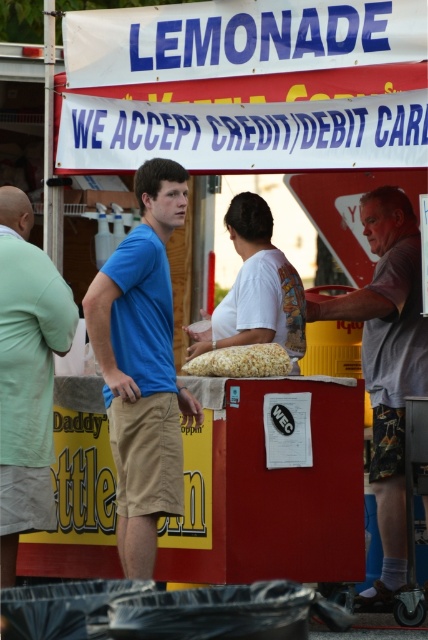
Is gray fabric shorts at right further to camera compared to golden popcorn at center?

Yes.

Between point (425, 515) and point (262, 374), which one is positioned behind?

Positioned behind is point (425, 515).

Between point (386, 490) and point (278, 352), which one is positioned in front?

Point (278, 352)

The image size is (428, 640). In order to click on gray fabric shorts at right in this screenshot , I will do `click(388, 364)`.

Can you confirm if blue cotton shirt at left is taller than white matte t-shirt at center?

Correct, blue cotton shirt at left is much taller as white matte t-shirt at center.

Which is behind, point (148, 474) or point (264, 237)?

Positioned behind is point (264, 237).

I want to click on blue cotton shirt at left, so click(142, 365).

Where is `blue cotton shirt at left`? blue cotton shirt at left is located at coordinates (142, 365).

Describe the element at coordinates (388, 364) in the screenshot. The image size is (428, 640). I see `gray fabric shorts at right` at that location.

Identify the location of gray fabric shorts at right. The height and width of the screenshot is (640, 428). (388, 364).

The image size is (428, 640). I want to click on gray fabric shorts at right, so click(x=388, y=364).